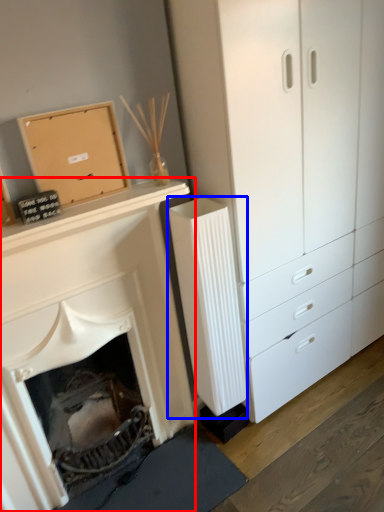
Question: Which point is closer to the camera, fireplace (highlighted by a red box) or radiator (highlighted by a blue box)?

Choices:
 (A) fireplace
 (B) radiator

Answer: (A)